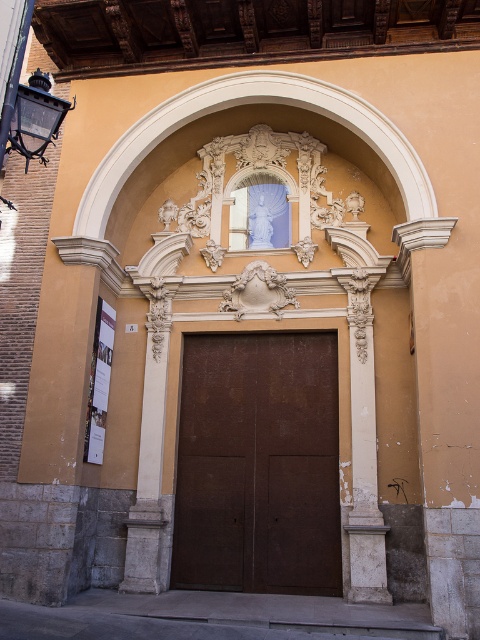
In the scene shown: You are standing at the entrance of the building and want to walk towards the statue in the niche. There are two points marked on the ground in front of you. The first point is at coordinate point [327,579] and the second point is at coordinate point [164,321]. Which point should you step on first to reach the statue?

Point [327,579] is in front of point [164,321], so you should step on point [327,579] first to reach the statue.

You are a painter hired to paint the entrance of this building. You need to determine which object, the brown matte door at center or the white stone column at left, requires more vertical space for your ladder. Based on their heights, which one should you prepare a taller ladder for?

The white stone column at left requires a taller ladder because it is taller than the brown matte door at center.

Consider the image. You are a painter hired to paint the entrance. You need to decide which object, the brown matte door at center or the white stone column at left, requires more paint because it has a larger surface area. Based on the scene description, which object should you prioritize?

The brown matte door at center is bigger than the white stone column at left, so it has a larger surface area and requires more paint. You should prioritize painting the brown matte door at center first.